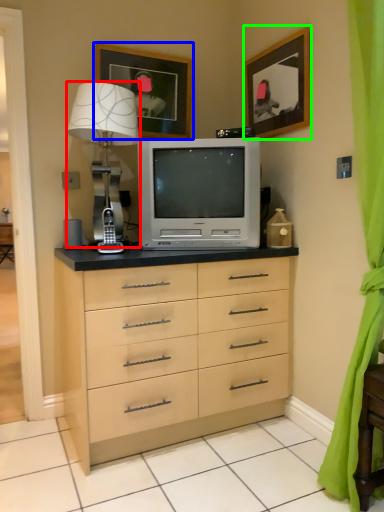
Question: Estimate the real-world distances between objects in this image. Which object is farther from table lamp (highlighted by a red box), picture frame (highlighted by a blue box) or picture frame (highlighted by a green box)?

Choices:
 (A) picture frame
 (B) picture frame

Answer: (B)